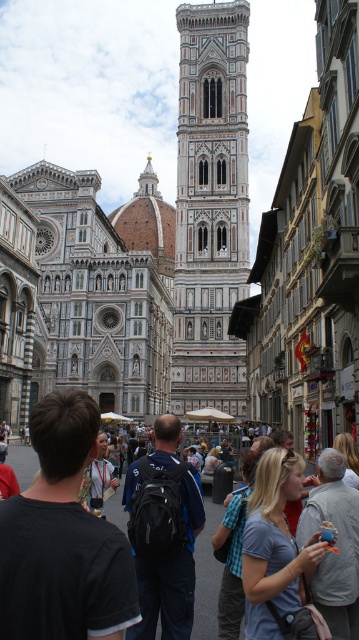
Is blue fabric backpack at center to the right of blue plaid shirt at center from the viewer's perspective?

No, blue fabric backpack at center is not to the right of blue plaid shirt at center.

Is blue fabric backpack at center above blue plaid shirt at center?

Correct, blue fabric backpack at center is located above blue plaid shirt at center.

What do you see at coordinates (170, 573) in the screenshot? I see `blue fabric backpack at center` at bounding box center [170, 573].

Locate an element on the screen. blue fabric backpack at center is located at coordinates (170, 573).

Can you confirm if gray stone bell tower at center is positioned to the right of matte gray backpack at lower right?

In fact, gray stone bell tower at center is to the left of matte gray backpack at lower right.

Who is positioned more to the left, gray stone bell tower at center or matte gray backpack at lower right?

From the viewer's perspective, gray stone bell tower at center appears more on the left side.

Find the location of `gray stone bell tower at center`. gray stone bell tower at center is located at coordinates (211, 208).

Is blue plaid shirt at center further to the viewer compared to matte black backpack at center?

Yes, blue plaid shirt at center is behind matte black backpack at center.

Is blue plaid shirt at center to the right of matte black backpack at center from the viewer's perspective?

Yes, blue plaid shirt at center is to the right of matte black backpack at center.

This screenshot has width=359, height=640. Find the location of `blue plaid shirt at center`. blue plaid shirt at center is located at coordinates (235, 548).